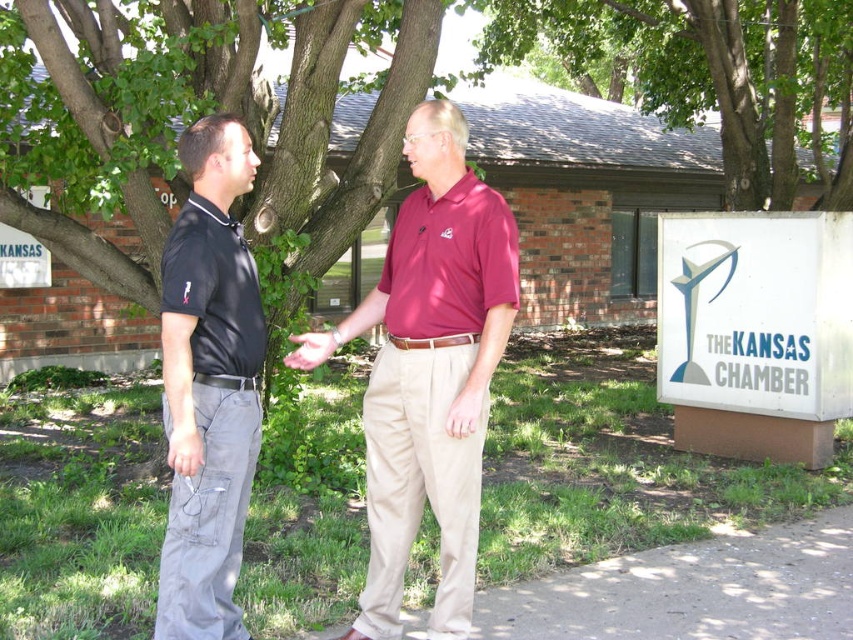
You are a painter standing at the base of the green leafy tree at upper center, holding a paintbrush in your matte gray hand at center. You want to paint a mural on the brick wall behind the two men. Can you reach the wall with your arm extended?

The green leafy tree at upper center is 6.58 meters away from the matte gray hand at center. Since the distance between the tree and your hand is over 6 meters, you cannot reach the brick wall behind the men with your arm extended.

You are a photographer standing 3 meters away from the matte red shirt at center. Can you adjust your position to get a closer shot without moving the subject?

The matte red shirt at center is currently 2.91 meters away from the camera. Since you are already positioned at 3 meters away, you need to move 0.09 meters closer to the matte red shirt at center to achieve a closer shot without moving the subject.